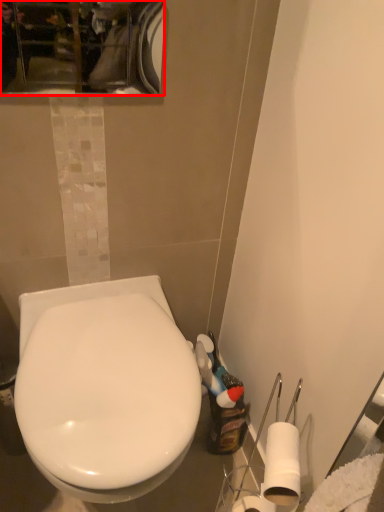
Question: From the image's perspective, what is the correct spatial positioning of mirror (annotated by the red box) in reference to toilet?

Choices:
 (A) above
 (B) below

Answer: (A)